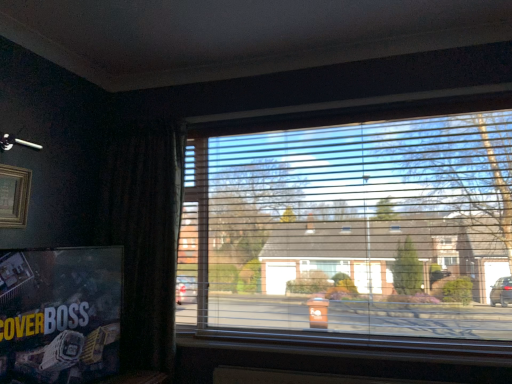
Question: Is wooden picture frame at upper left closer to the viewer compared to matte black poster at lower left?

Choices:
 (A) yes
 (B) no

Answer: (B)

Question: Is wooden picture frame at upper left thinner than matte black poster at lower left?

Choices:
 (A) yes
 (B) no

Answer: (A)

Question: Is wooden picture frame at upper left not inside matte black poster at lower left?

Choices:
 (A) yes
 (B) no

Answer: (A)

Question: Considering the relative sizes of wooden picture frame at upper left and matte black poster at lower left in the image provided, is wooden picture frame at upper left smaller than matte black poster at lower left?

Choices:
 (A) no
 (B) yes

Answer: (B)

Question: Is matte black poster at lower left a part of wooden picture frame at upper left?

Choices:
 (A) no
 (B) yes

Answer: (A)

Question: Considering the relative sizes of wooden picture frame at upper left and matte black poster at lower left in the image provided, is wooden picture frame at upper left taller than matte black poster at lower left?

Choices:
 (A) no
 (B) yes

Answer: (A)

Question: Is wooden picture frame at upper left positioned in front of transparent plastic blinds at center?

Choices:
 (A) yes
 (B) no

Answer: (A)

Question: Considering the relative sizes of wooden picture frame at upper left and transparent plastic blinds at center in the image provided, is wooden picture frame at upper left smaller than transparent plastic blinds at center?

Choices:
 (A) yes
 (B) no

Answer: (A)

Question: From a real-world perspective, is wooden picture frame at upper left positioned over transparent plastic blinds at center based on gravity?

Choices:
 (A) no
 (B) yes

Answer: (B)

Question: From a real-world perspective, is wooden picture frame at upper left physically below transparent plastic blinds at center?

Choices:
 (A) no
 (B) yes

Answer: (A)

Question: Is wooden picture frame at upper left bigger than transparent plastic blinds at center?

Choices:
 (A) yes
 (B) no

Answer: (B)

Question: Can you confirm if wooden picture frame at upper left is positioned to the left of transparent plastic blinds at center?

Choices:
 (A) yes
 (B) no

Answer: (A)

Question: Can you confirm if matte black poster at lower left is smaller than transparent plastic blinds at center?

Choices:
 (A) no
 (B) yes

Answer: (B)